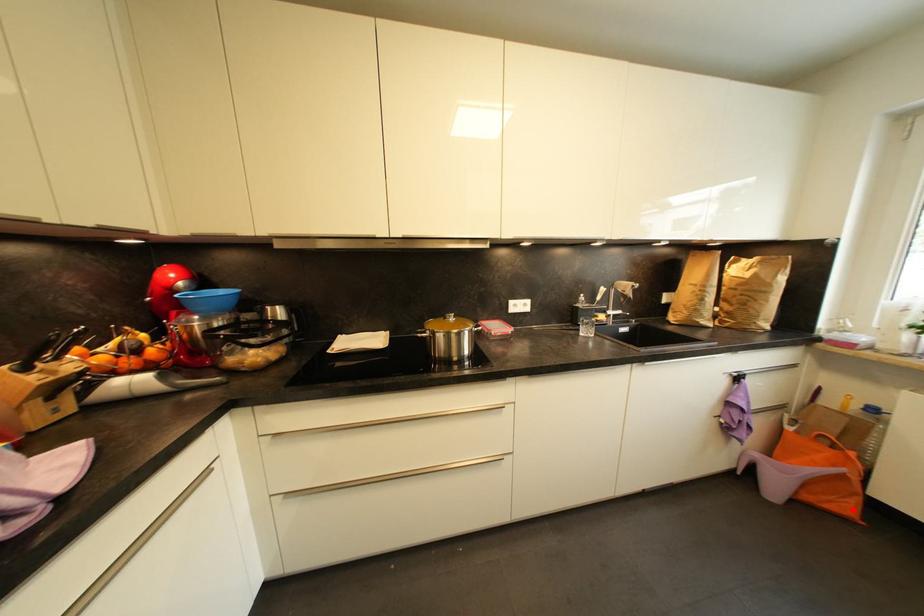
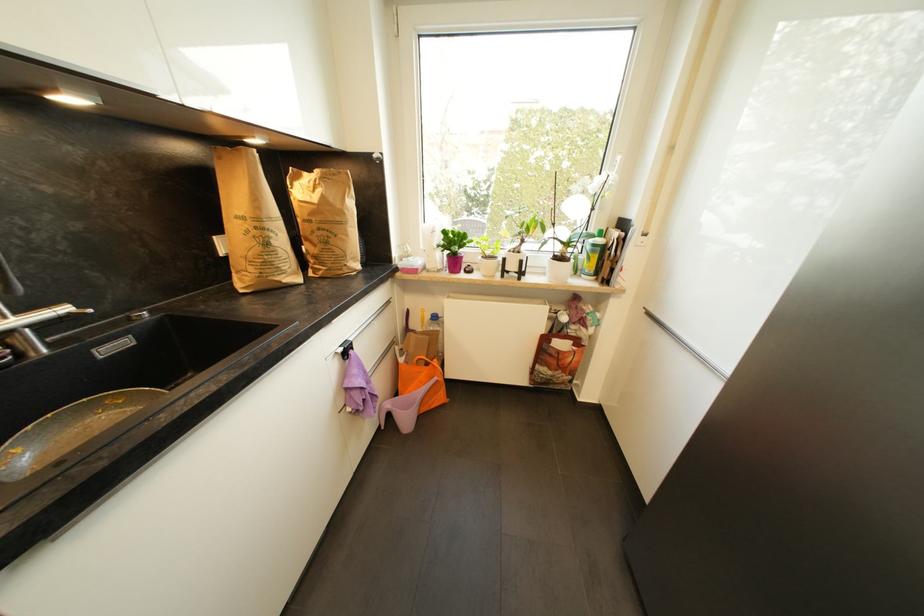
Question: I am providing you with two images of the same scene from different viewpoints. A red point is shown in image1. For the corresponding object point in image2, is it positioned nearer or farther from the camera?

Choices:
 (A) Nearer
 (B) Farther

Answer: (A)